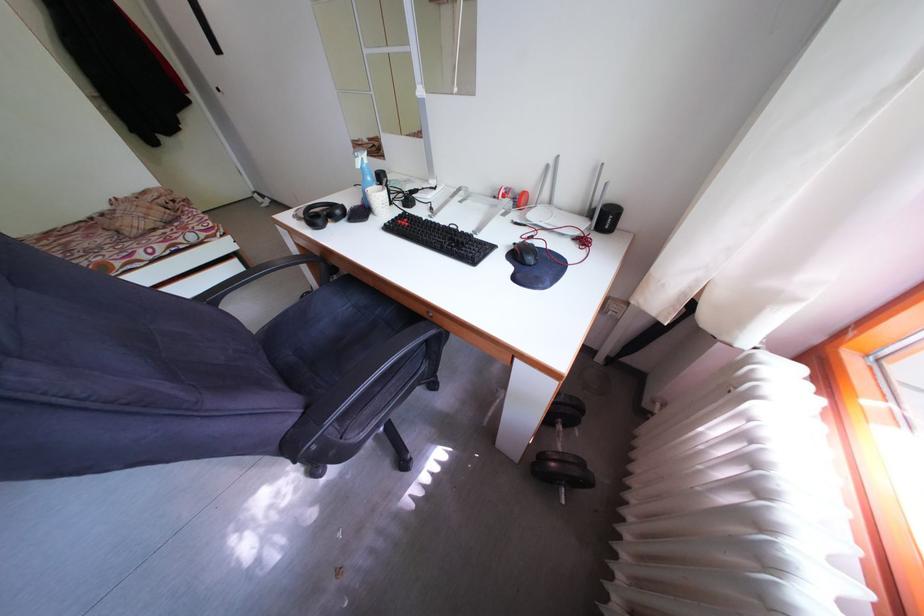
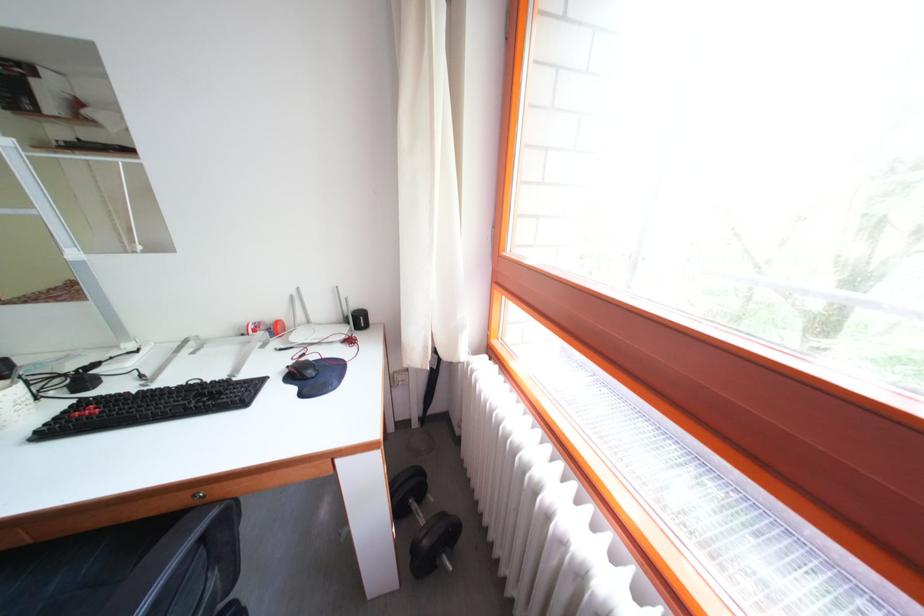
Where in the second image is the point corresponding to [460,233] from the first image?

(201, 389)